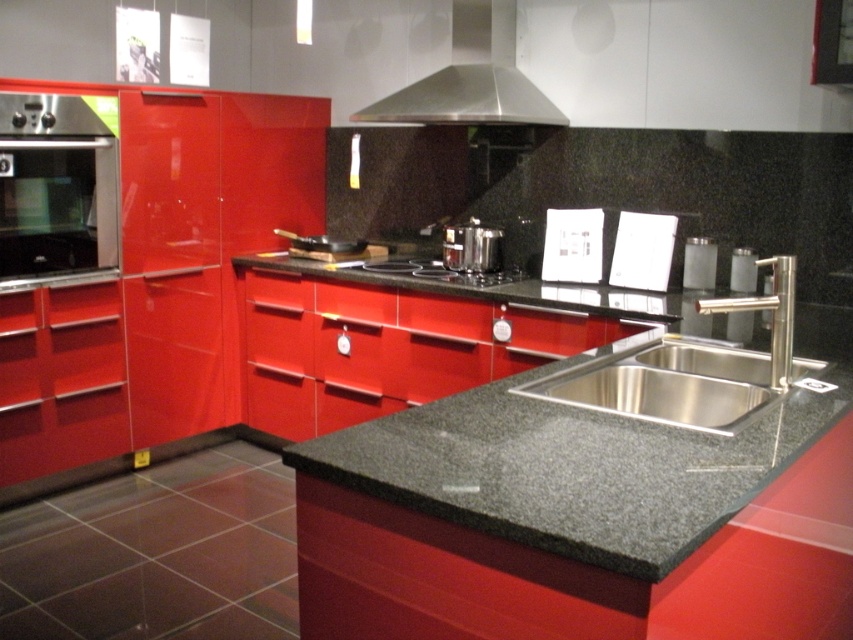
Consider the image. You are a chef trying to place a new pot in the kitchen. You see the stainless steel sink at center and the satin silver pot at center. Which object is closer to you?

The stainless steel sink at center is closer to you because it is in front of the satin silver pot at center.

You are a kitchen designer planning to place a satin silver pot at center on the stainless steel sink at center. Will the pot fit entirely on the sink?

The stainless steel sink at center is wider than the satin silver pot at center, so the pot will fit entirely on the sink.